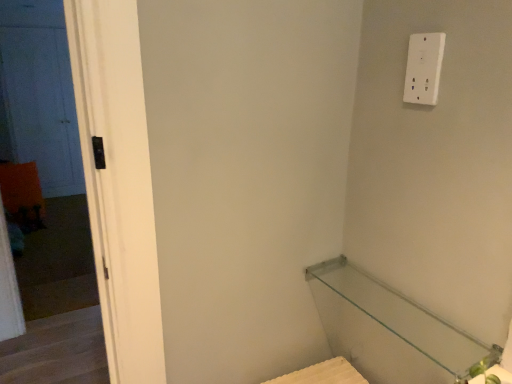
Question: Considering the relative sizes of white matte door at left and transparent glass shelf at lower right in the image provided, is white matte door at left thinner than transparent glass shelf at lower right?

Choices:
 (A) yes
 (B) no

Answer: (A)

Question: Would you consider white matte door at left to be distant from transparent glass shelf at lower right?

Choices:
 (A) no
 (B) yes

Answer: (B)

Question: Is white matte door at left to the right of transparent glass shelf at lower right from the viewer's perspective?

Choices:
 (A) no
 (B) yes

Answer: (A)

Question: Is the position of white matte door at left more distant than that of transparent glass shelf at lower right?

Choices:
 (A) no
 (B) yes

Answer: (B)

Question: Is transparent glass shelf at lower right located within white matte door at left?

Choices:
 (A) yes
 (B) no

Answer: (B)

Question: Is white matte door at left beside transparent glass shelf at lower right?

Choices:
 (A) yes
 (B) no

Answer: (B)

Question: Does transparent glass shelf at lower right lie in front of white matte door at left?

Choices:
 (A) no
 (B) yes

Answer: (B)

Question: Is transparent glass shelf at lower right outside of white matte door at left?

Choices:
 (A) no
 (B) yes

Answer: (B)

Question: Can you confirm if transparent glass shelf at lower right is shorter than white matte door at left?

Choices:
 (A) no
 (B) yes

Answer: (B)

Question: From a real-world perspective, is transparent glass shelf at lower right over white matte door at left?

Choices:
 (A) yes
 (B) no

Answer: (A)

Question: From a real-world perspective, does transparent glass shelf at lower right sit lower than white matte door at left?

Choices:
 (A) yes
 (B) no

Answer: (B)

Question: Is transparent glass shelf at lower right to the left of white matte door at left from the viewer's perspective?

Choices:
 (A) yes
 (B) no

Answer: (B)

Question: Does black matte door at left lie behind transparent glass shelf at lower right?

Choices:
 (A) yes
 (B) no

Answer: (A)